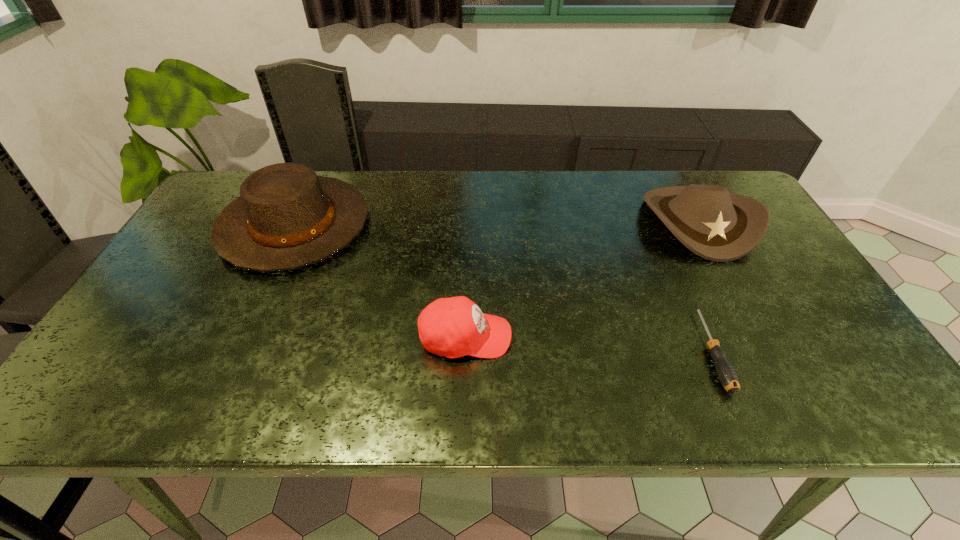
Select which object is the third closest to the leftmost object. Please provide its 2D coordinates. Your answer should be formatted as a tuple, i.e. [(x, y)], where the tuple contains the x and y coordinates of a point satisfying the conditions above.

[(726, 373)]

Where is `object that is the third closest one to the third object from right to left`? The width and height of the screenshot is (960, 540). object that is the third closest one to the third object from right to left is located at coordinates (719, 226).

Where is `vacant region that satisfies the following two spatial constraints: 1. on the back side of the screwdriver; 2. on the front panel of the second object from left to right`? vacant region that satisfies the following two spatial constraints: 1. on the back side of the screwdriver; 2. on the front panel of the second object from left to right is located at coordinates (705, 337).

Locate an element on the screen. Image resolution: width=960 pixels, height=540 pixels. free space that satisfies the following two spatial constraints: 1. on the back side of the shortest object; 2. on the front panel of the third tallest object is located at coordinates (705, 337).

At what (x,y) coordinates should I click in order to perform the action: click on vacant region that satisfies the following two spatial constraints: 1. with a star on the front of the shorter cowboy hat; 2. on the front panel of the second object from left to right. Please return your answer as a coordinate pair (x, y). The image size is (960, 540). Looking at the image, I should click on (761, 337).

The width and height of the screenshot is (960, 540). What are the coordinates of `free region that satisfies the following two spatial constraints: 1. on the front panel of the second shortest object; 2. on the back side of the shortest object` in the screenshot? It's located at (466, 350).